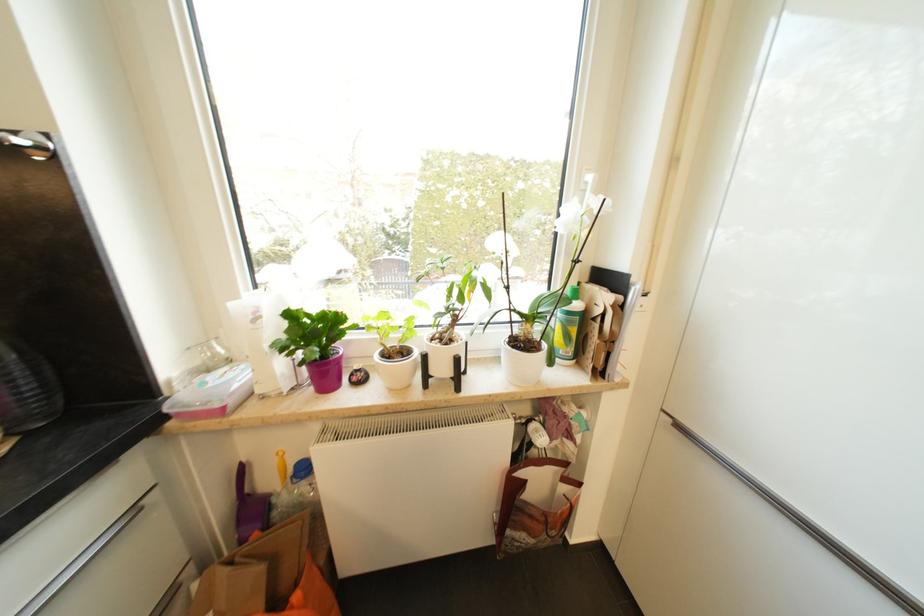
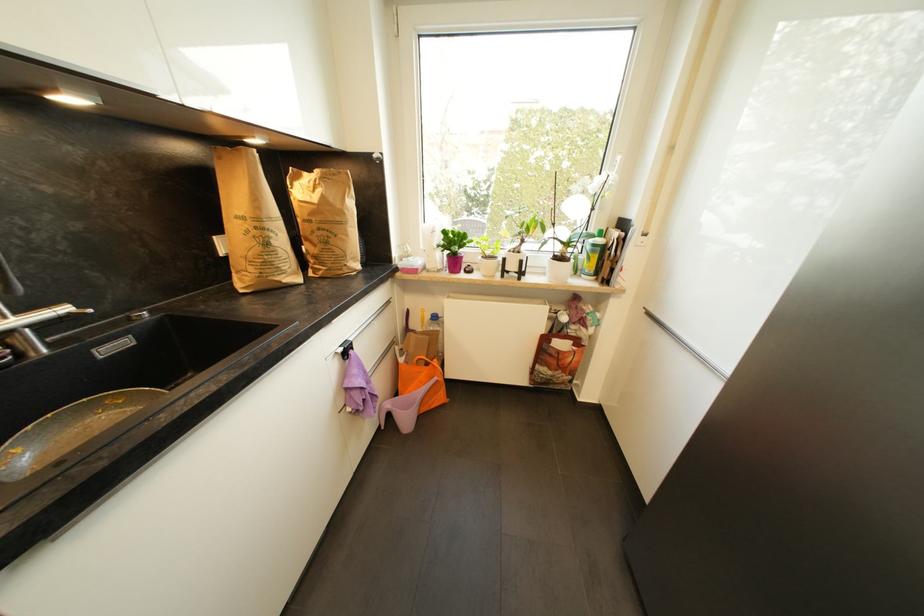
In the second image, find the point that corresponds to pixel 446 371 in the first image.

(517, 268)